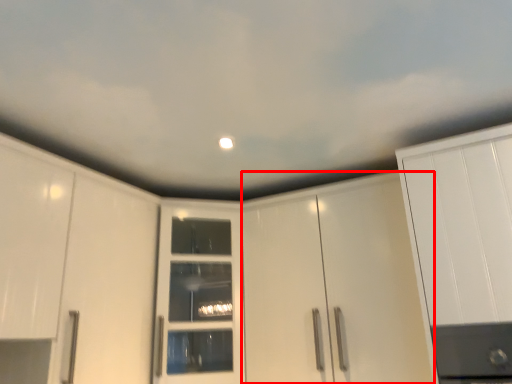
Question: From the image's perspective, considering the relative positions of cabinetry (annotated by the red box) and door in the image provided, where is cabinetry (annotated by the red box) located with respect to the staircase?

Choices:
 (A) above
 (B) below

Answer: (A)